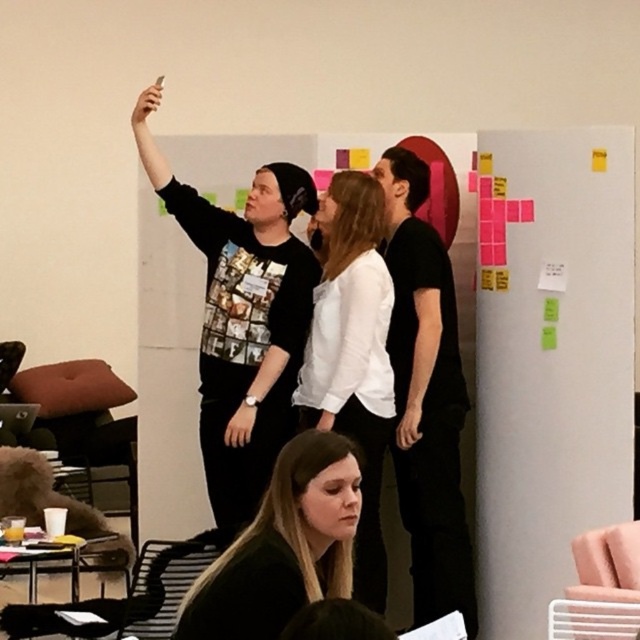
Question: Which object is farther from the camera taking this photo?

Choices:
 (A) black matte shirt at center
 (B) black matte shirt at lower center
 (C) black matte sweatshirt at upper left
 (D) white matte shirt at center

Answer: (A)

Question: Does black matte sweatshirt at upper left appear over black matte shirt at center?

Choices:
 (A) yes
 (B) no

Answer: (A)

Question: Which point is farther to the camera?

Choices:
 (A) white matte shirt at center
 (B) black matte shirt at center

Answer: (B)

Question: Which point is closer to the camera taking this photo?

Choices:
 (A) coord(458,550)
 (B) coord(259,531)

Answer: (B)

Question: Does black matte sweatshirt at upper left lie in front of black matte shirt at center?

Choices:
 (A) yes
 (B) no

Answer: (A)

Question: Does black matte shirt at center lie in front of white matte shirt at center?

Choices:
 (A) no
 (B) yes

Answer: (A)